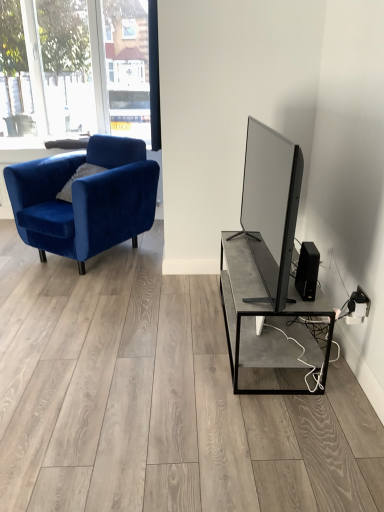
Question: Is black matte speaker at lower right inside the boundaries of velvet blue armchair at left, or outside?

Choices:
 (A) outside
 (B) inside

Answer: (A)

Question: Is point (304, 268) positioned closer to the camera than point (96, 204)?

Choices:
 (A) closer
 (B) farther

Answer: (A)

Question: From the image's perspective, relative to velvet blue armchair at left, is black matte speaker at lower right above or below?

Choices:
 (A) below
 (B) above

Answer: (A)

Question: Based on their sizes in the image, would you say velvet blue armchair at left is bigger or smaller than black matte speaker at lower right?

Choices:
 (A) small
 (B) big

Answer: (B)

Question: From the image's perspective, is velvet blue armchair at left located above or below black matte speaker at lower right?

Choices:
 (A) below
 (B) above

Answer: (B)

Question: From a real-world perspective, is velvet blue armchair at left physically located above or below black matte speaker at lower right?

Choices:
 (A) above
 (B) below

Answer: (B)

Question: Considering their positions, is velvet blue armchair at left located in front of or behind black matte speaker at lower right?

Choices:
 (A) front
 (B) behind

Answer: (B)